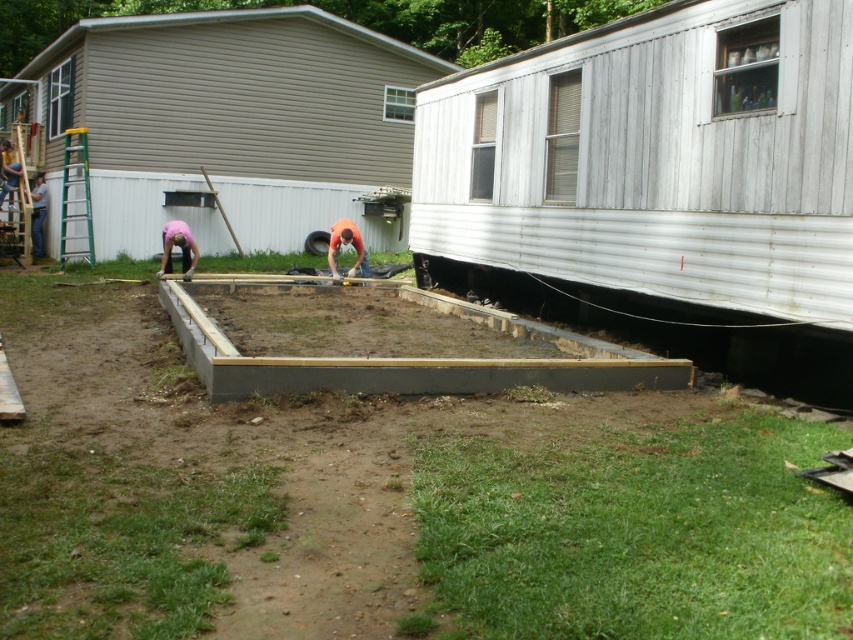
Is point (422, 392) farther from camera compared to point (358, 246)?

No.

Who is more forward, (289, 380) or (331, 266)?

Point (289, 380) is in front.

Is point (311, 376) farther from camera compared to point (345, 234)?

No, it is not.

Locate an element on the screen. gray concrete foundation at center is located at coordinates (416, 362).

Which is below, brown wooden frame at center or pink fabric at center?

brown wooden frame at center is lower down.

Is point (68, 616) positioned before point (183, 264)?

Yes, point (68, 616) is in front of point (183, 264).

Locate an element on the screen. brown wooden frame at center is located at coordinates (387, 500).

Can you confirm if pink fabric at center is shorter than orange fabric construction worker at center?

In fact, pink fabric at center may be taller than orange fabric construction worker at center.

What do you see at coordinates (178, 246) in the screenshot?
I see `pink fabric at center` at bounding box center [178, 246].

This screenshot has width=853, height=640. In order to click on pink fabric at center in this screenshot , I will do `click(178, 246)`.